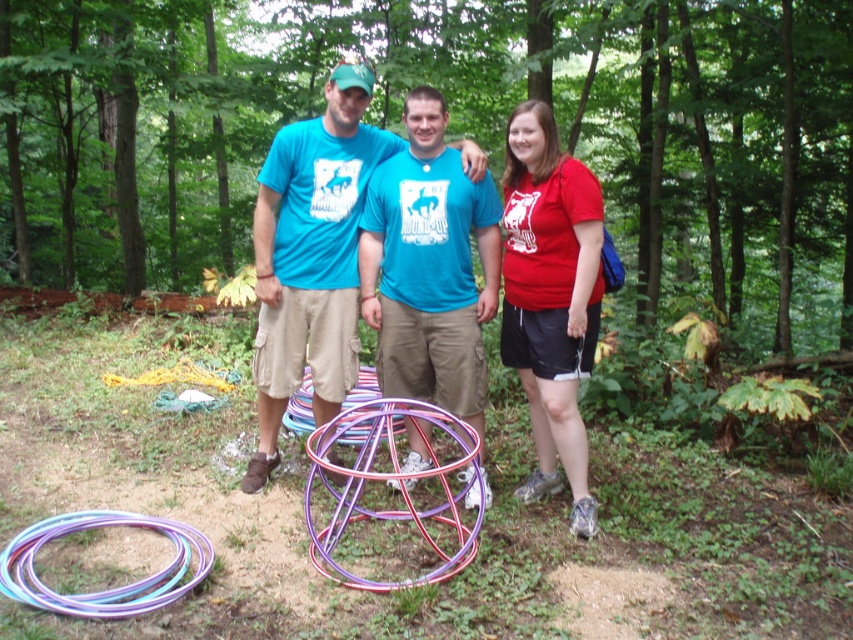
Question: Which point appears farthest from the camera in this image?

Choices:
 (A) (430, 516)
 (B) (271, 444)
 (C) (570, 396)

Answer: (B)

Question: Is metallic multicolored hula hoop at center closer to the viewer compared to multicolored plastic hula hoop at lower left?

Choices:
 (A) no
 (B) yes

Answer: (A)

Question: Which object is closer to the camera taking this photo?

Choices:
 (A) blue t-shirt at center
 (B) matte red t-shirt at right
 (C) multicolored plastic hula hoop at lower left

Answer: (C)

Question: Does blue t-shirt at center appear on the right side of matte blue t-shirt at center?

Choices:
 (A) yes
 (B) no

Answer: (B)

Question: Which of the following is the closest to the observer?

Choices:
 (A) (260, 278)
 (B) (437, 474)
 (C) (399, 310)
 (D) (531, 189)

Answer: (B)

Question: Does blue t-shirt at center appear on the left side of matte blue t-shirt at center?

Choices:
 (A) yes
 (B) no

Answer: (A)